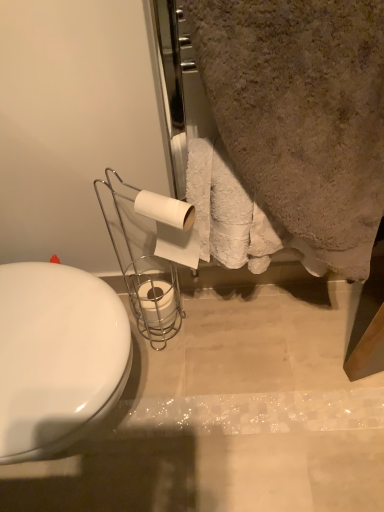
Question: Is there a large distance between white matte toilet paper at center, positioned as the 1th toilet paper in top-to-bottom order, and beige textured towel at upper right?

Choices:
 (A) yes
 (B) no

Answer: (B)

Question: From the image's perspective, would you say white matte toilet paper at center, which appears as the second toilet paper when viewed from the back, is shown under beige textured towel at upper right?

Choices:
 (A) yes
 (B) no

Answer: (A)

Question: Can we say white matte toilet paper at center, which appears as the second toilet paper when viewed from the back, lies outside beige textured towel at upper right?

Choices:
 (A) yes
 (B) no

Answer: (A)

Question: Is white matte toilet paper at center, which is the first toilet paper from front to back, looking in the opposite direction of beige textured towel at upper right?

Choices:
 (A) no
 (B) yes

Answer: (B)

Question: Is white matte toilet paper at center, positioned as the second toilet paper in bottom-to-top order, to the right of beige textured towel at upper right from the viewer's perspective?

Choices:
 (A) yes
 (B) no

Answer: (B)

Question: Is white matte toilet paper at center, which is the first toilet paper from front to back, thinner than beige textured towel at upper right?

Choices:
 (A) yes
 (B) no

Answer: (A)

Question: From a real-world perspective, is beige textured towel at upper right physically below white matte toilet paper at center, which ranks as the 2th toilet paper in top-to-bottom order?

Choices:
 (A) yes
 (B) no

Answer: (B)

Question: Is beige textured towel at upper right looking in the opposite direction of white matte toilet paper at center, the 2th toilet paper in the front-to-back sequence?

Choices:
 (A) no
 (B) yes

Answer: (A)

Question: From the image's perspective, is beige textured towel at upper right on top of white matte toilet paper at center, which ranks as the 2th toilet paper in top-to-bottom order?

Choices:
 (A) no
 (B) yes

Answer: (B)

Question: From a real-world perspective, is beige textured towel at upper right physically above white matte toilet paper at center, the 1th toilet paper from the back?

Choices:
 (A) yes
 (B) no

Answer: (A)

Question: Is beige textured towel at upper right oriented towards white matte toilet paper at center, the 1th toilet paper from the back?

Choices:
 (A) no
 (B) yes

Answer: (A)

Question: Would you say beige textured towel at upper right contains white matte toilet paper at center, the 1th toilet paper from the back?

Choices:
 (A) no
 (B) yes

Answer: (A)

Question: Is the depth of white matte toilet paper at center, which appears as the first toilet paper when ordered from the bottom, greater than that of white matte toilet paper at center, which appears as the second toilet paper when viewed from the back?

Choices:
 (A) yes
 (B) no

Answer: (A)